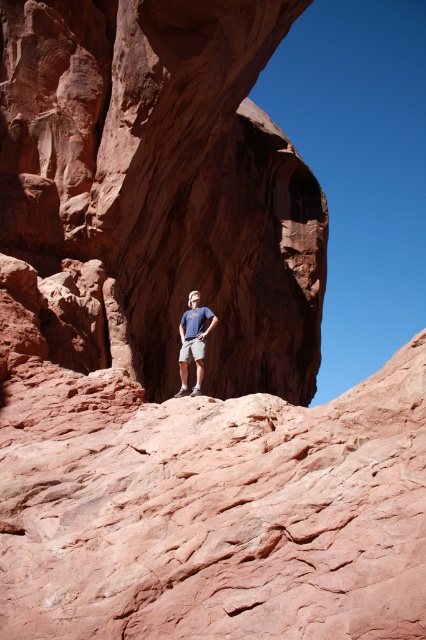
Who is higher up, reddish-brown sandstone arch at center or matte blue t-shirt at center?

reddish-brown sandstone arch at center is higher up.

Between reddish-brown sandstone arch at center and matte blue t-shirt at center, which one has less height?

With less height is matte blue t-shirt at center.

What do you see at coordinates (166, 179) in the screenshot?
I see `reddish-brown sandstone arch at center` at bounding box center [166, 179].

You are a GUI agent. You are given a task and a screenshot of the screen. Output one action in this format:
    pyautogui.click(x=<x>, y=<y>)
    Task: Click on the reddish-brown sandstone arch at center
    This screenshot has height=640, width=426.
    Given the screenshot: What is the action you would take?
    pyautogui.click(x=166, y=179)